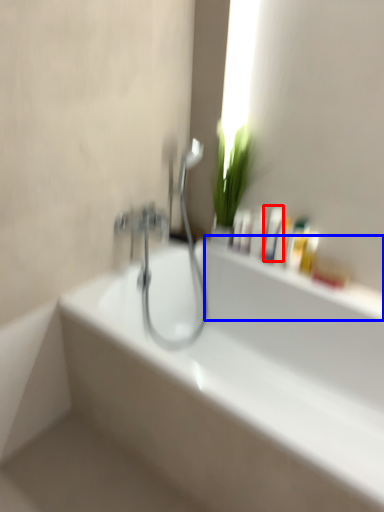
Question: Which object is further to the camera taking this photo, mouthwash (highlighted by a red box) or window sill (highlighted by a blue box)?

Choices:
 (A) mouthwash
 (B) window sill

Answer: (A)